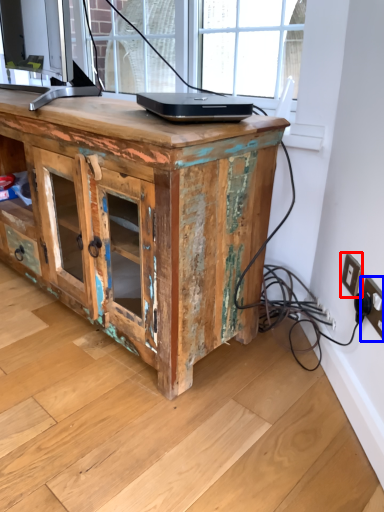
Question: Among these objects, which one is farthest to the camera, electric outlet (highlighted by a red box) or electric outlet (highlighted by a blue box)?

Choices:
 (A) electric outlet
 (B) electric outlet

Answer: (A)